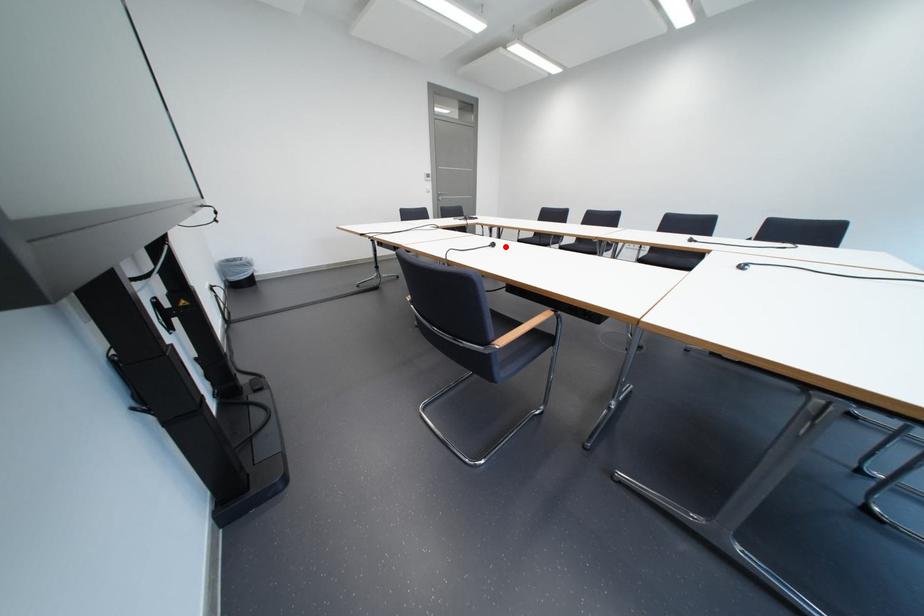
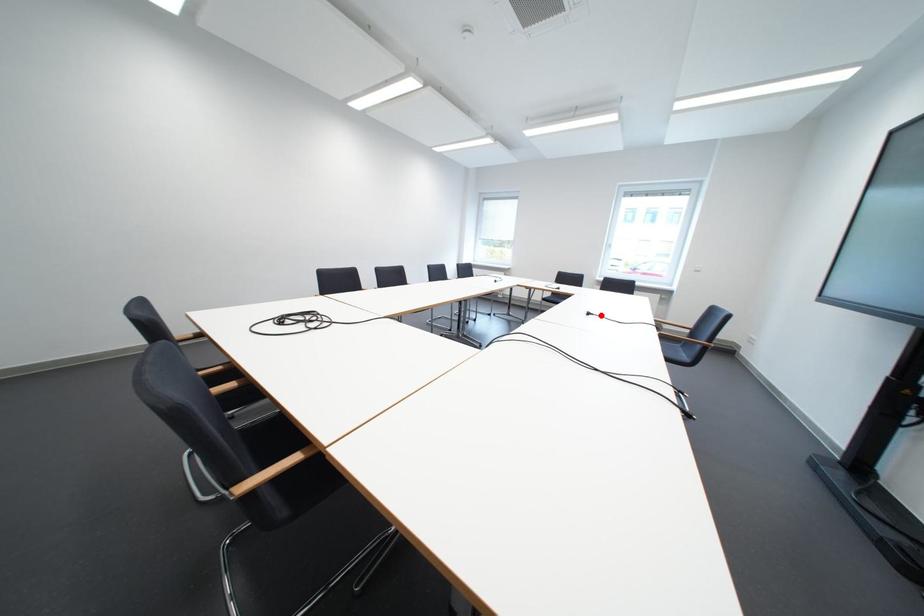
I am providing you with two images of the same scene from different viewpoints. A red point is marked on the first image and another point is marked on the second image. Does the point marked in image1 correspond to the same location as the one in image2?

Yes